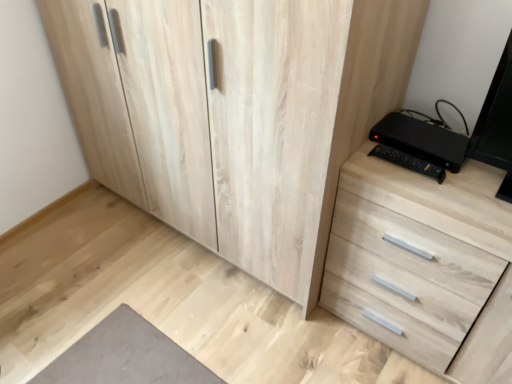
Where is `space that is in front of black plastic at right`? The height and width of the screenshot is (384, 512). space that is in front of black plastic at right is located at coordinates (449, 185).